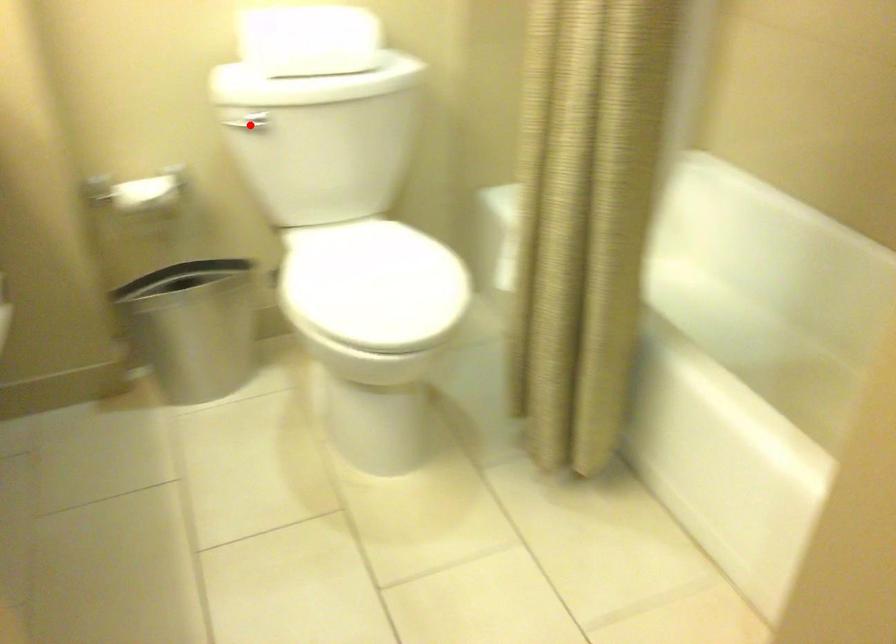
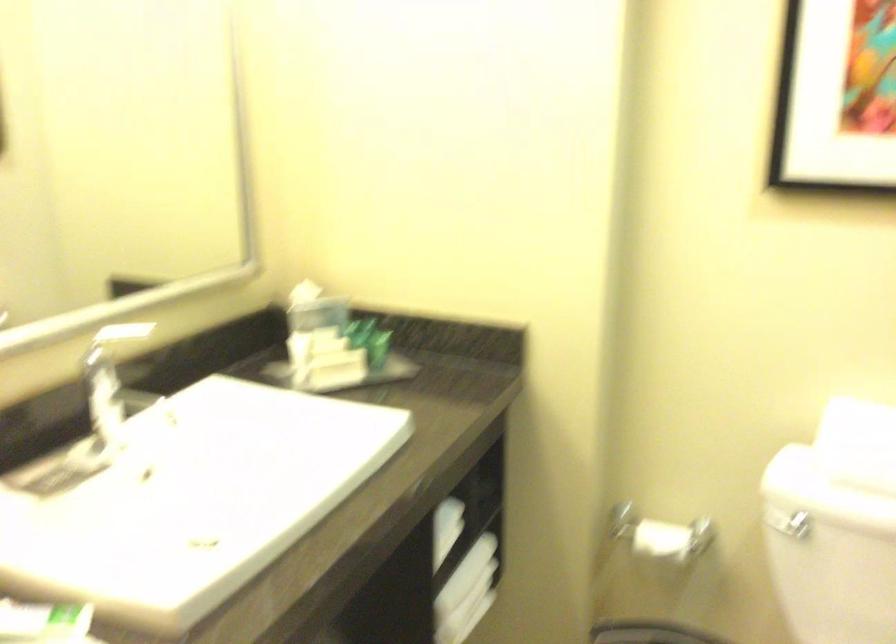
Where in the second image is the point corresponding to the highlighted location from the first image?

(788, 524)